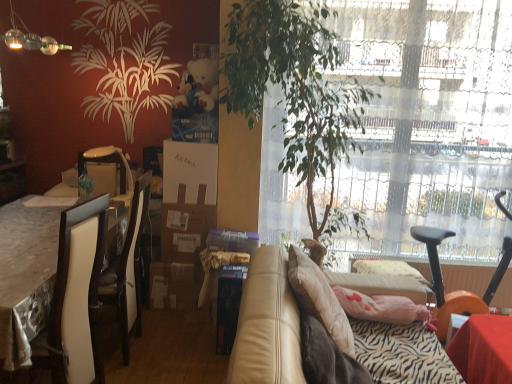
Question: From a real-world perspective, is matte glass lamp at upper left positioned over white glossy table at left based on gravity?

Choices:
 (A) yes
 (B) no

Answer: (A)

Question: From the image's perspective, is matte glass lamp at upper left on white glossy table at left?

Choices:
 (A) yes
 (B) no

Answer: (A)

Question: Is matte glass lamp at upper left not inside white glossy table at left?

Choices:
 (A) no
 (B) yes

Answer: (B)

Question: Can you confirm if matte glass lamp at upper left is bigger than white glossy table at left?

Choices:
 (A) yes
 (B) no

Answer: (B)

Question: Is matte glass lamp at upper left beside white glossy table at left?

Choices:
 (A) yes
 (B) no

Answer: (B)

Question: Considering the relative sizes of matte glass lamp at upper left and white glossy table at left in the image provided, is matte glass lamp at upper left shorter than white glossy table at left?

Choices:
 (A) no
 (B) yes

Answer: (B)

Question: Is fluffy white teddy bear at upper center beside green leafy plant at center?

Choices:
 (A) no
 (B) yes

Answer: (A)

Question: Is fluffy white teddy bear at upper center in front of green leafy plant at center?

Choices:
 (A) yes
 (B) no

Answer: (B)

Question: Is fluffy white teddy bear at upper center bigger than green leafy plant at center?

Choices:
 (A) no
 (B) yes

Answer: (A)

Question: From a real-world perspective, is fluffy white teddy bear at upper center below green leafy plant at center?

Choices:
 (A) yes
 (B) no

Answer: (B)

Question: Considering the relative sizes of fluffy white teddy bear at upper center and green leafy plant at center in the image provided, is fluffy white teddy bear at upper center smaller than green leafy plant at center?

Choices:
 (A) no
 (B) yes

Answer: (B)

Question: Does fluffy white teddy bear at upper center appear on the right side of green leafy plant at center?

Choices:
 (A) no
 (B) yes

Answer: (A)

Question: Can you confirm if leather couch at center is shorter than matte white armchair at left?

Choices:
 (A) yes
 (B) no

Answer: (B)